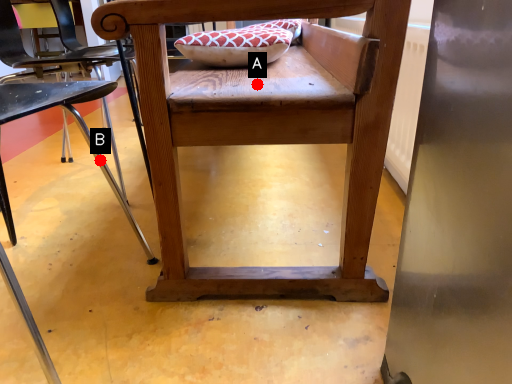
Question: Two points are circled on the image, labeled by A and B beside each circle. Which point is closer to the camera taking this photo?

Choices:
 (A) A is closer
 (B) B is closer

Answer: (A)